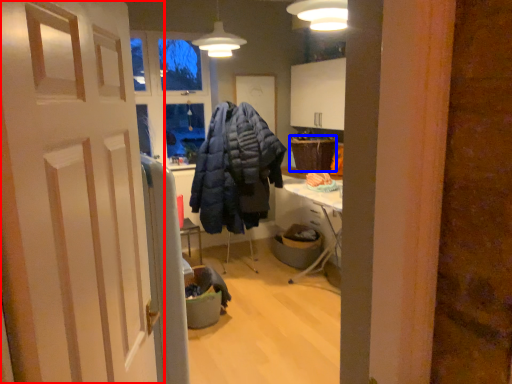
Question: Which of the following is the farthest to the observer, door (highlighted by a red box) or picnic basket (highlighted by a blue box)?

Choices:
 (A) door
 (B) picnic basket

Answer: (B)